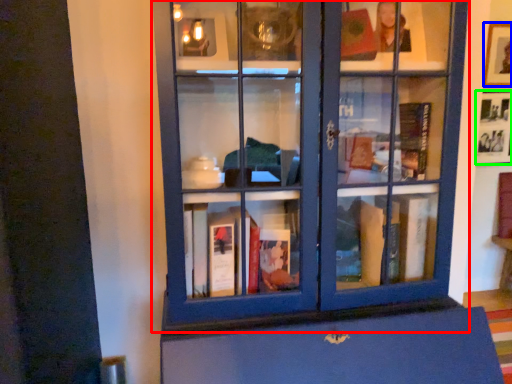
Question: Which is nearer to the bookcase (highlighted by a red box)? picture frame (highlighted by a blue box) or picture frame (highlighted by a green box).

Choices:
 (A) picture frame
 (B) picture frame

Answer: (B)